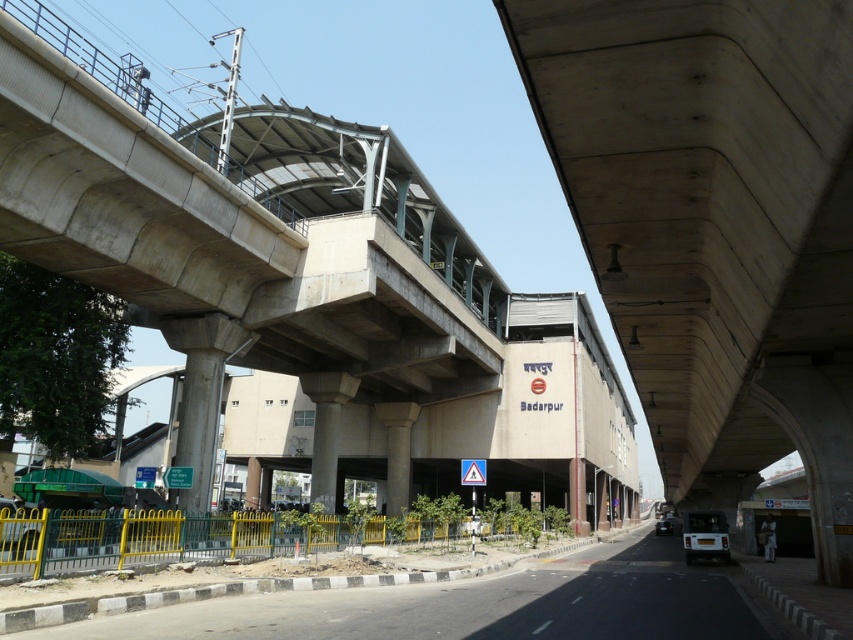
Question: Can you confirm if yellow metal fence at lower left is thinner than white concrete pillar at center?

Choices:
 (A) yes
 (B) no

Answer: (B)

Question: From the image, what is the correct spatial relationship of white concrete pillar at center in relation to concrete column at center?

Choices:
 (A) below
 (B) above

Answer: (B)

Question: Which object is farther from the camera taking this photo?

Choices:
 (A) yellow metal fence at lower left
 (B) concrete bridge at center
 (C) white concrete pillar at center

Answer: (C)

Question: Which is nearer to the concrete column at center?

Choices:
 (A) yellow metal fence at lower left
 (B) concrete bridge at center

Answer: (B)

Question: Is yellow metal fence at lower left bigger than concrete column at center?

Choices:
 (A) yes
 (B) no

Answer: (A)

Question: Which point appears closest to the camera in this image?

Choices:
 (A) (373, 422)
 (B) (473, 611)
 (C) (350, 394)

Answer: (B)